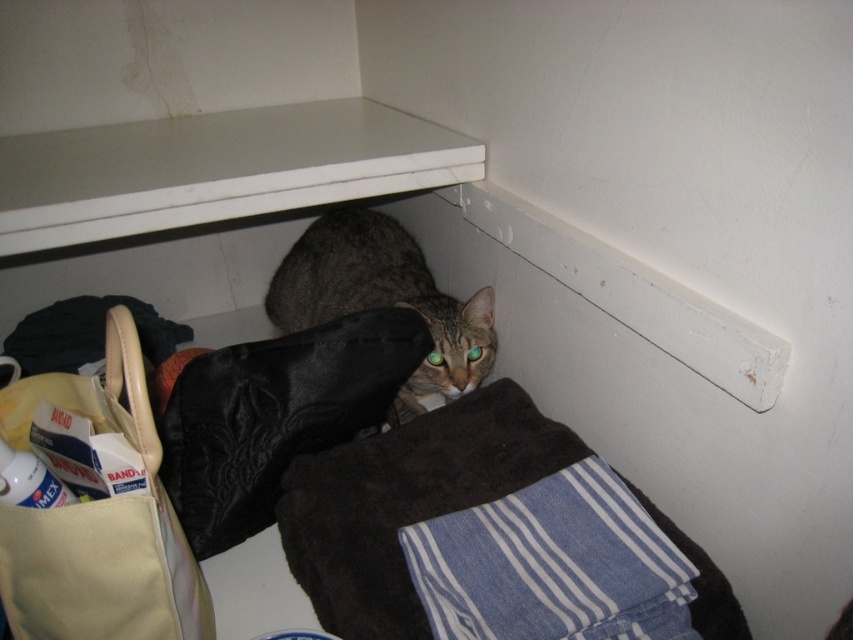
Question: Which object appears farthest from the camera in this image?

Choices:
 (A) white matte shelf at upper center
 (B) tabby fur cat at center

Answer: (B)

Question: Which object is positioned closest to the blue striped fabric at lower right?

Choices:
 (A) white matte shelf at upper center
 (B) yellow fabric bag at lower left
 (C) tabby fur cat at center

Answer: (B)

Question: Estimate the real-world distances between objects in this image. Which object is farther from the yellow fabric bag at lower left?

Choices:
 (A) tabby fur cat at center
 (B) white matte shelf at upper center

Answer: (A)

Question: Is white matte shelf at upper center positioned before tabby fur cat at center?

Choices:
 (A) no
 (B) yes

Answer: (B)

Question: Does blue striped fabric at lower right appear on the left side of yellow fabric bag at lower left?

Choices:
 (A) yes
 (B) no

Answer: (B)

Question: Does blue striped fabric at lower right appear over yellow fabric bag at lower left?

Choices:
 (A) no
 (B) yes

Answer: (A)